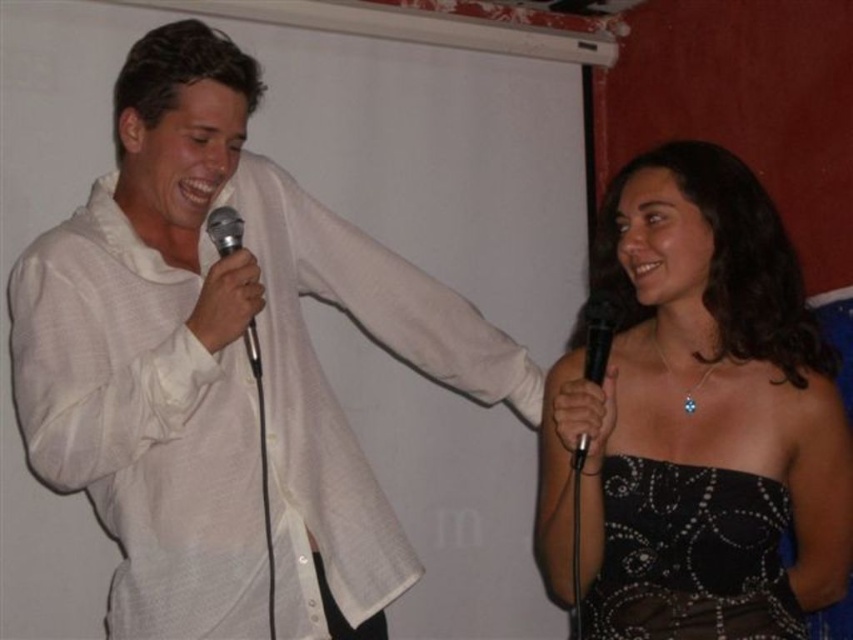
Which is in front, point (651, 284) or point (601, 356)?

Point (601, 356)

Is black satin dress at right shorter than black matte microphone at right?

In fact, black satin dress at right may be taller than black matte microphone at right.

Does point (708, 161) come behind point (579, 445)?

Yes.

Where is `black satin dress at right`? Image resolution: width=853 pixels, height=640 pixels. black satin dress at right is located at coordinates (697, 419).

Is black sequined dress at lower right taller than black matte microphone at right?

No.

Who is higher up, black sequined dress at lower right or black matte microphone at right?

black matte microphone at right is higher up.

What are the coordinates of `black sequined dress at lower right` in the screenshot? It's located at (689, 556).

The height and width of the screenshot is (640, 853). Identify the location of black sequined dress at lower right. (689, 556).

Is point (155, 301) positioned before point (625, 620)?

No, it is behind (625, 620).

Who is higher up, white linen shirt at left or black satin dress at right?

Positioned higher is black satin dress at right.

Describe the element at coordinates (224, 368) in the screenshot. This screenshot has width=853, height=640. I see `white linen shirt at left` at that location.

You are a GUI agent. You are given a task and a screenshot of the screen. Output one action in this format:
    pyautogui.click(x=<x>, y=<y>)
    Task: Click on the white linen shirt at left
    The width and height of the screenshot is (853, 640).
    Given the screenshot: What is the action you would take?
    pyautogui.click(x=224, y=368)